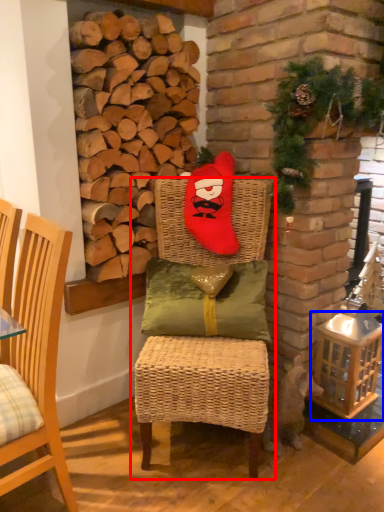
Question: Which point is further to the camera, chair (highlighted by a red box) or basket (highlighted by a blue box)?

Choices:
 (A) chair
 (B) basket

Answer: (B)